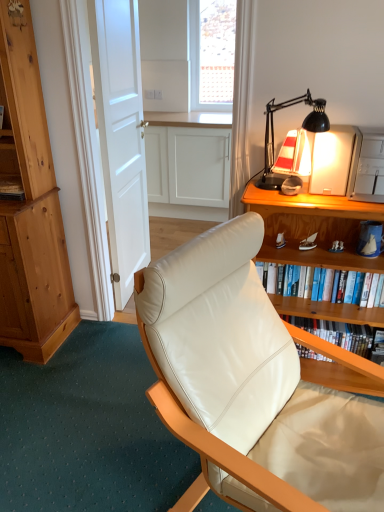
Question: Is wooden desk at right to the left or to the right of black matte desk lamp at upper right in the image?

Choices:
 (A) left
 (B) right

Answer: (B)

Question: From the image's perspective, relative to black matte desk lamp at upper right, is wooden desk at right above or below?

Choices:
 (A) below
 (B) above

Answer: (A)

Question: Which object is positioned closest to the hardcover book at right, the 1th book positioned from the top?

Choices:
 (A) hardcover book at center, arranged as the first book when ordered from the bottom
 (B) white mesh screen at upper center
 (C) wooden desk at right
 (D) white matte door at center
 (E) black matte desk lamp at upper right

Answer: (C)

Question: Which is nearer to the hardcover book at right, the 1th book positioned from the top?

Choices:
 (A) white leather chair at center
 (B) white matte door at center
 (C) white mesh screen at upper center
 (D) black matte desk lamp at upper right
 (E) hardcover book at center, positioned as the second book in top-to-bottom order

Answer: (E)